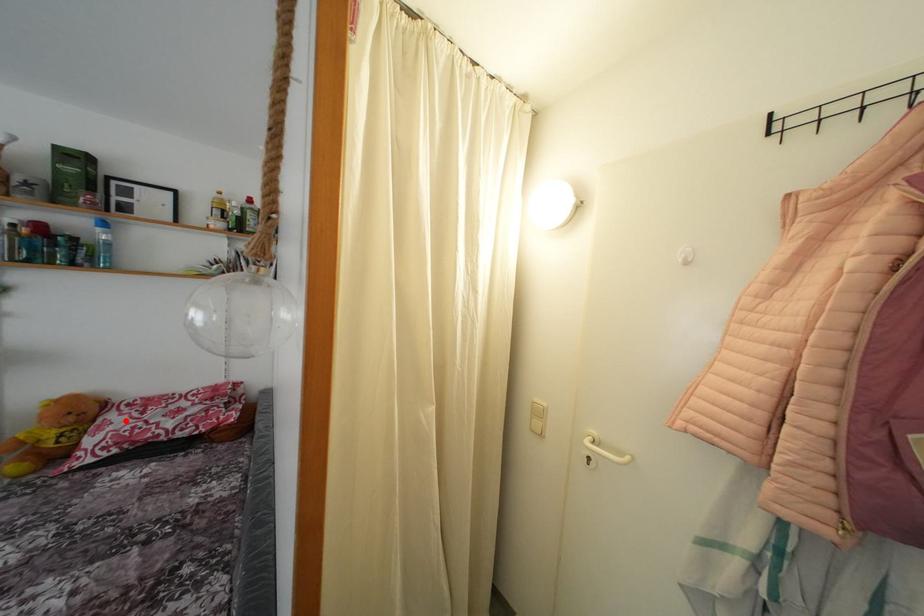
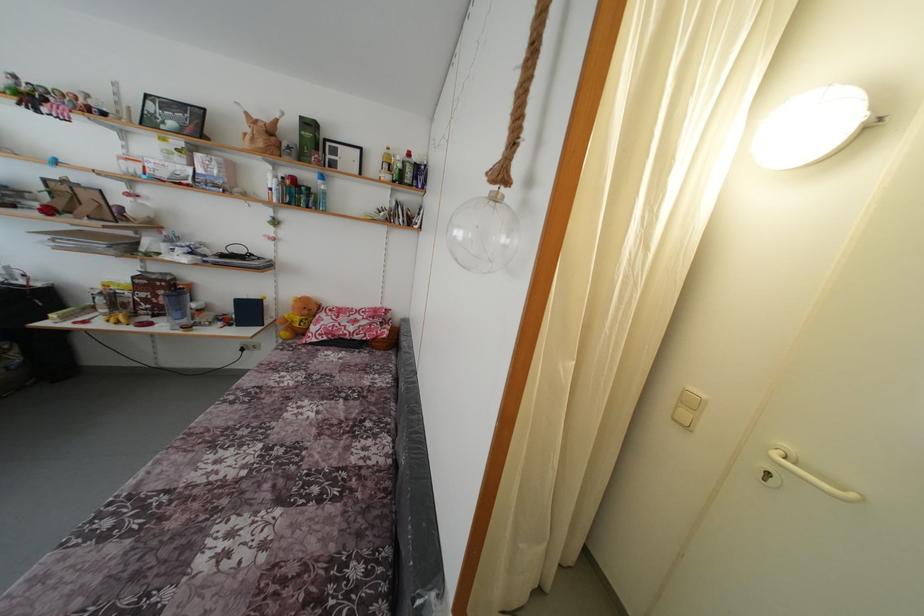
Where in the second image is the point corresponding to the highlighted location from the first image?

(332, 321)